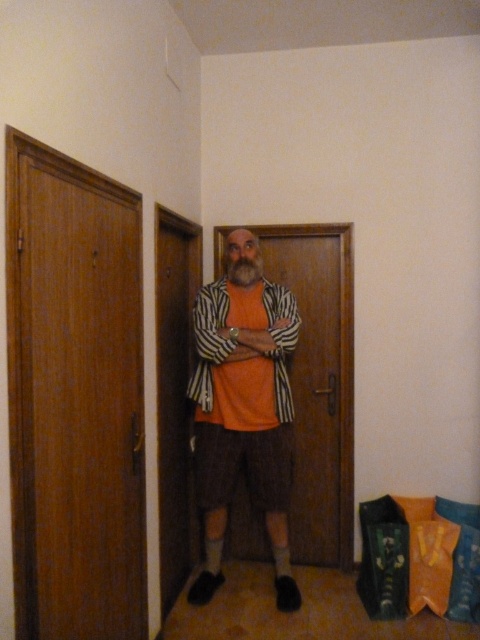
Is wooden door at left positioned at the back of orange cotton shirt at center?

That is False.

Is wooden door at left to the right of orange cotton shirt at center from the viewer's perspective?

In fact, wooden door at left is to the left of orange cotton shirt at center.

Is point (134, 401) behind point (212, 285)?

No, it is not.

I want to click on wooden door at left, so click(x=80, y=401).

Looking at this image, does orange cotton shirt at center have a smaller size compared to wooden door at center?

No, orange cotton shirt at center is not smaller than wooden door at center.

Measure the distance between point (235, 253) and camera.

They are 9.72 feet apart.

Between point (253, 248) and point (348, 349), which one is positioned in front?

Point (253, 248) is more forward.

This screenshot has height=640, width=480. I want to click on orange cotton shirt at center, so (243, 419).

Looking at this image, does wooden door at left have a smaller size compared to orange matte shirt at center?

Incorrect, wooden door at left is not smaller in size than orange matte shirt at center.

Between wooden door at left and orange matte shirt at center, which one has less height?

With less height is orange matte shirt at center.

Which is in front, point (123, 196) or point (283, 288)?

Point (123, 196)

At what (x,y) coordinates should I click in order to perform the action: click on wooden door at left. Please return your answer as a coordinate pair (x, y). The height and width of the screenshot is (640, 480). Looking at the image, I should click on (80, 401).